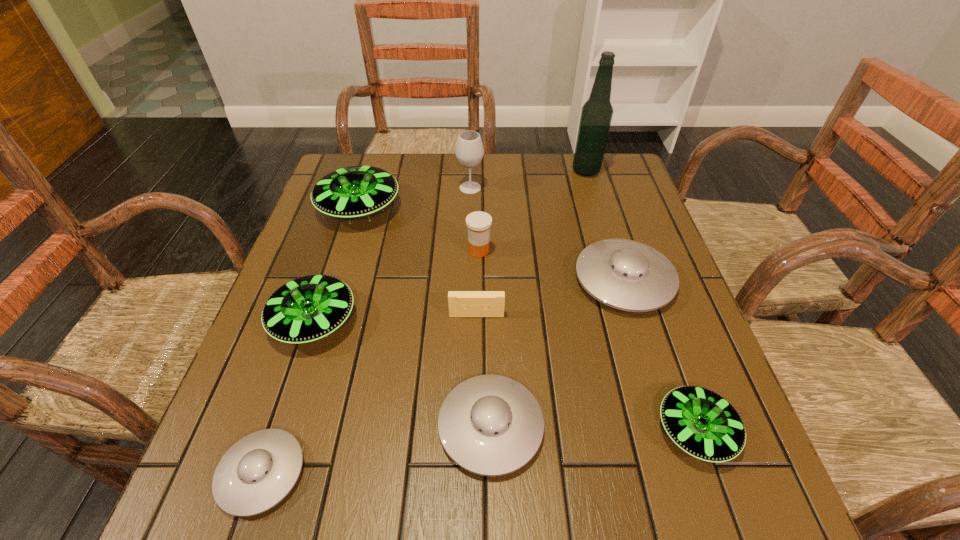
Find the location of a particular element. the rightmost green saucer is located at coordinates (702, 423).

Find the location of `the smallest green saucer`. the smallest green saucer is located at coordinates (702, 423).

Identify the location of videotape. The width and height of the screenshot is (960, 540). (461, 303).

Image resolution: width=960 pixels, height=540 pixels. Find the location of `the third saucer from right to left`. the third saucer from right to left is located at coordinates (491, 425).

You are a GUI agent. You are given a task and a screenshot of the screen. Output one action in this format:
    pyautogui.click(x=<x>, y=<y>)
    Task: Click on the second gray saucer from right to left
    This screenshot has width=960, height=540.
    Given the screenshot: What is the action you would take?
    pyautogui.click(x=491, y=425)

You are a GUI agent. You are given a task and a screenshot of the screen. Output one action in this format:
    pyautogui.click(x=<x>, y=<y>)
    Task: Click on the smallest gray saucer
    
    Given the screenshot: What is the action you would take?
    pyautogui.click(x=258, y=471)

Locate an element on the screen. the shortest saucer is located at coordinates (258, 471).

Locate an element on the screen. vacant space located 0.050m on the front of the green alcohol is located at coordinates (591, 188).

At what (x,y) coordinates should I click in order to perform the action: click on vacant space located on the back of the ninth shortest object. Please return your answer as a coordinate pair (x, y). Looking at the image, I should click on (471, 162).

The height and width of the screenshot is (540, 960). What are the coordinates of `vacant region located 0.050m on the right of the farthest saucer` in the screenshot? It's located at (419, 208).